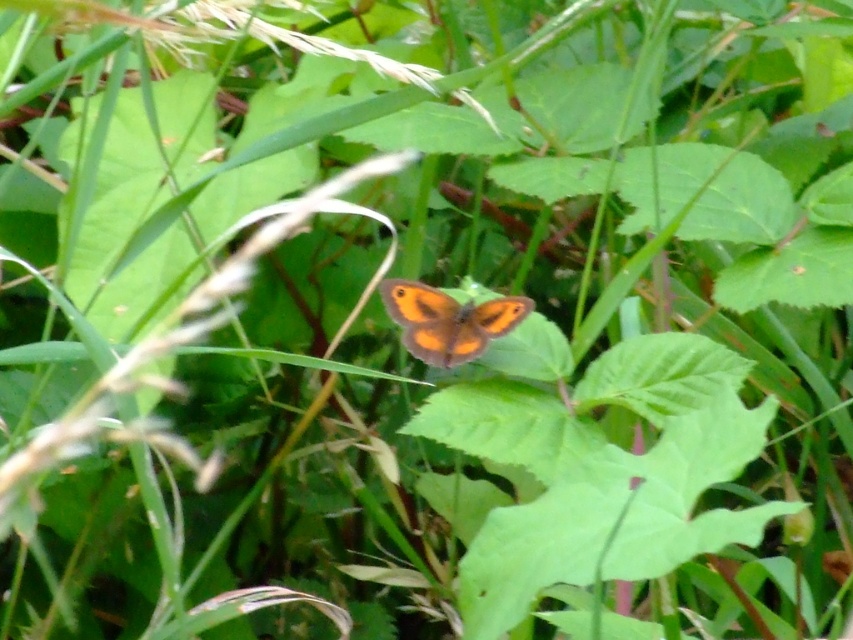
Is green matte leaf at center smaller than orange matte butterfly at center?

Incorrect, green matte leaf at center is not smaller in size than orange matte butterfly at center.

Does point (592, 428) come closer to viewer compared to point (457, 332)?

Yes, it is.

Where is `green matte leaf at center`? green matte leaf at center is located at coordinates (509, 428).

In the scene shown: Is green smooth leaf at center to the left of orange matte butterfly at center from the viewer's perspective?

In fact, green smooth leaf at center is to the right of orange matte butterfly at center.

Looking at this image, can you confirm if green smooth leaf at center is positioned to the right of orange matte butterfly at center?

Correct, you'll find green smooth leaf at center to the right of orange matte butterfly at center.

Is point (732, 371) in front of point (421, 308)?

Yes.

At what (x,y) coordinates should I click in order to perform the action: click on green smooth leaf at center. Please return your answer as a coordinate pair (x, y). Looking at the image, I should click on (660, 374).

Between point (547, 436) and point (659, 346), which one is positioned in front?

Positioned in front is point (547, 436).

Which is more to the left, green matte leaf at center or green smooth leaf at center?

green matte leaf at center is more to the left.

Find the location of a particular element. This screenshot has height=640, width=853. green matte leaf at center is located at coordinates [x=509, y=428].